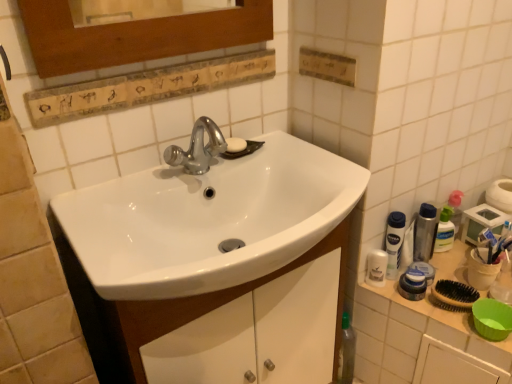
Question: Are white plastic bottle at right, which is the 2th mouthwash from left to right, and white plastic container at right located far from each other?

Choices:
 (A) no
 (B) yes

Answer: (A)

Question: From a real-world perspective, does white plastic bottle at right, the 4th mouthwash viewed from the right, stand above white plastic container at right?

Choices:
 (A) yes
 (B) no

Answer: (A)

Question: Does white plastic bottle at right, which is the 2th mouthwash from left to right, have a smaller size compared to white plastic container at right?

Choices:
 (A) no
 (B) yes

Answer: (B)

Question: Is white plastic bottle at right, which is the 2th mouthwash from left to right, taller than white plastic container at right?

Choices:
 (A) no
 (B) yes

Answer: (A)

Question: Does white plastic bottle at right, which is the 2th mouthwash from left to right, appear on the left side of white plastic container at right?

Choices:
 (A) no
 (B) yes

Answer: (B)

Question: From a real-world perspective, is white matte toothpaste at right above or below translucent plastic mouthwash at right, arranged as the 3th mouthwash when viewed from the left?

Choices:
 (A) above
 (B) below

Answer: (A)

Question: Is white matte toothpaste at right taller or shorter than translucent plastic mouthwash at right, the 3th mouthwash in the right-to-left sequence?

Choices:
 (A) short
 (B) tall

Answer: (A)

Question: Is white matte toothpaste at right wider or thinner than translucent plastic mouthwash at right, the 3th mouthwash in the right-to-left sequence?

Choices:
 (A) thin
 (B) wide

Answer: (A)

Question: Is point (489, 240) closer or farther from the camera than point (407, 274)?

Choices:
 (A) closer
 (B) farther

Answer: (B)

Question: Considering the positions of white glossy sink at center and translucent plastic mouthwash at right, acting as the first mouthwash starting from the right, in the image, is white glossy sink at center taller or shorter than translucent plastic mouthwash at right, acting as the first mouthwash starting from the right,?

Choices:
 (A) tall
 (B) short

Answer: (B)

Question: Relative to translucent plastic mouthwash at right, the 5th mouthwash viewed from the left, is white glossy sink at center in front or behind?

Choices:
 (A) behind
 (B) front

Answer: (B)

Question: Considering the positions of point (135, 190) and point (453, 195), is point (135, 190) closer or farther from the camera than point (453, 195)?

Choices:
 (A) farther
 (B) closer

Answer: (B)

Question: Would you say white glossy sink at center is inside or outside translucent plastic mouthwash at right, acting as the first mouthwash starting from the right?

Choices:
 (A) inside
 (B) outside

Answer: (B)

Question: Is point (490, 243) closer or farther from the camera than point (126, 355)?

Choices:
 (A) farther
 (B) closer

Answer: (A)

Question: From a real-world perspective, is white matte toothpaste at right above or below white glossy sink at center?

Choices:
 (A) above
 (B) below

Answer: (A)